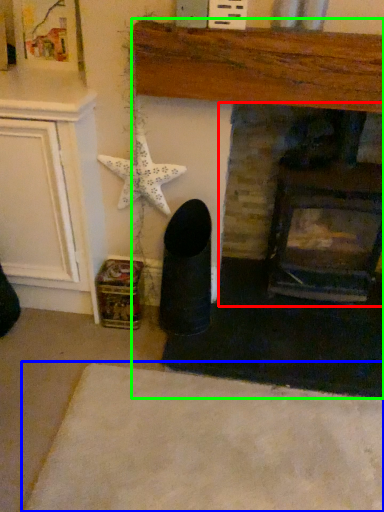
Question: Considering the real-world distances, which object is closest to fireplace (highlighted by a red box)? plain (highlighted by a blue box) or fireplace (highlighted by a green box).

Choices:
 (A) plain
 (B) fireplace

Answer: (B)